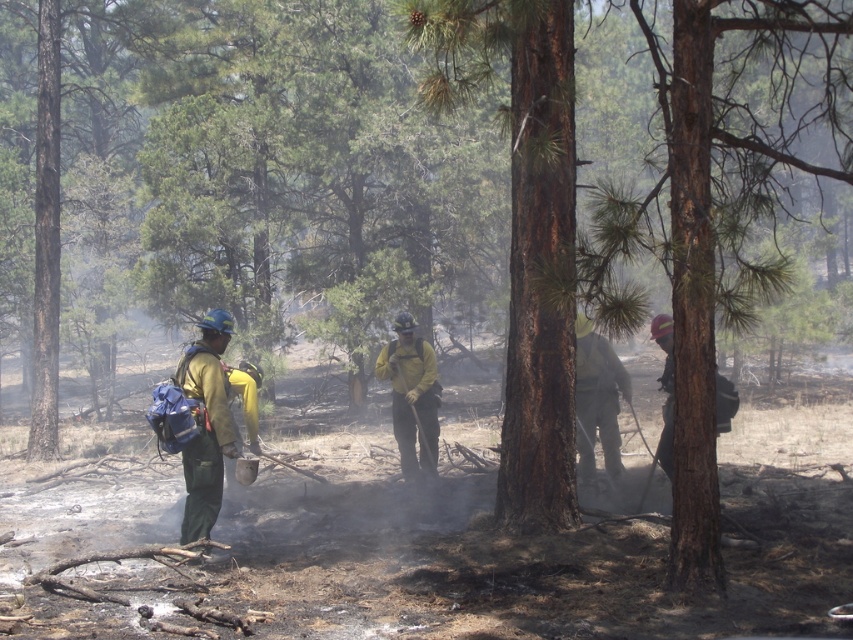
Question: Which object is positioned closest to the yellow-green uniform at center-left?

Choices:
 (A) green reflective vest at center
 (B) yellow fire-resistant suit at center

Answer: (A)

Question: Does yellow-green uniform at center-left appear over green reflective vest at center?

Choices:
 (A) no
 (B) yes

Answer: (A)

Question: Considering the relative positions of yellow fire-resistant suit at center and green reflective vest at center in the image provided, where is yellow fire-resistant suit at center located with respect to green reflective vest at center?

Choices:
 (A) above
 (B) below

Answer: (B)

Question: Estimate the real-world distances between objects in this image. Which object is closer to the green reflective vest at center?

Choices:
 (A) yellow-green uniform at center-left
 (B) yellow fire-resistant suit at center

Answer: (B)

Question: Is yellow-green uniform at center-left further to camera compared to green reflective vest at center?

Choices:
 (A) yes
 (B) no

Answer: (B)

Question: Which point is closer to the camera taking this photo?

Choices:
 (A) (x=605, y=428)
 (B) (x=428, y=371)
 (C) (x=212, y=468)

Answer: (C)